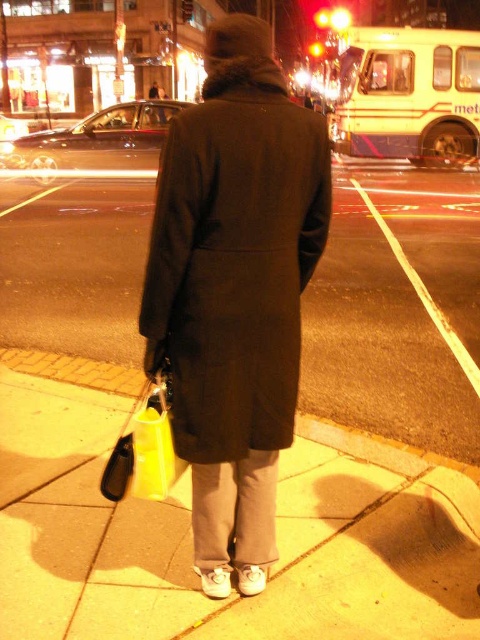
Question: Can you confirm if gray concrete sidewalk at center is positioned to the right of dark wool coat at center?

Choices:
 (A) no
 (B) yes

Answer: (A)

Question: Among these objects, which one is nearest to the camera?

Choices:
 (A) dark wool coat at center
 (B) gray concrete sidewalk at center

Answer: (A)

Question: Which of the following is the closest to the observer?

Choices:
 (A) (261, 358)
 (B) (67, 509)

Answer: (A)

Question: Can you confirm if gray concrete sidewalk at center is bigger than dark wool coat at center?

Choices:
 (A) no
 (B) yes

Answer: (B)

Question: Can you confirm if gray concrete sidewalk at center is positioned to the right of dark wool coat at center?

Choices:
 (A) no
 (B) yes

Answer: (A)

Question: Which point is closer to the camera taking this photo?

Choices:
 (A) tap(266, 401)
 (B) tap(310, 436)

Answer: (A)